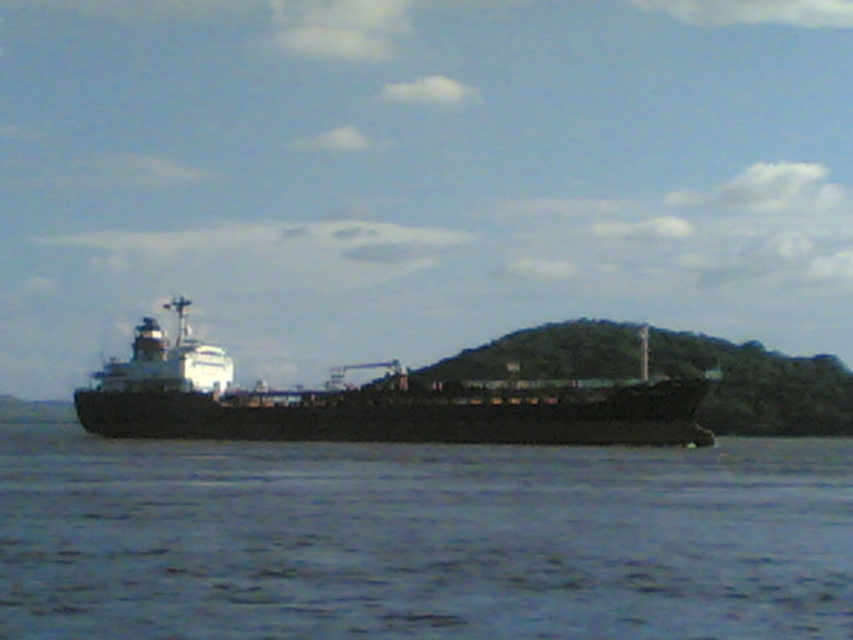
You are on a boat and looking at the scene. You see the blue water at lower center and the black matte ship at center. Which object is located lower in the image?

The blue water at lower center is located lower than the black matte ship at center in the image.

You are a sailor on a small boat that is 5 meters long. You want to pass through the space between the blue water at lower center and the black matte ship at center. Can your boat fit through the gap?

The distance between the blue water at lower center and the black matte ship at center is 15.00 meters, so your boat, which is 5 meters long, can easily pass through the gap since it is wider than the boat.

You are standing on the deck of the ship and want to reach a specific point marked as point [466,589]. If your maximum reach is 70 feet, can you reach that point without moving?

The point [466,589] is 74.98 feet away from the viewer, which exceeds your maximum reach of 70 feet. Therefore, you cannot reach it without moving.